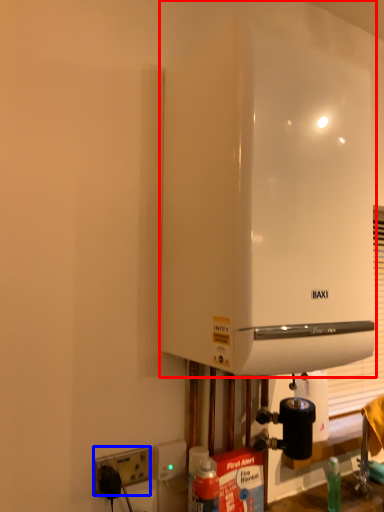
Question: Which of the following is the farthest to the observer, home appliance (highlighted by a red box) or electric outlet (highlighted by a blue box)?

Choices:
 (A) home appliance
 (B) electric outlet

Answer: (B)